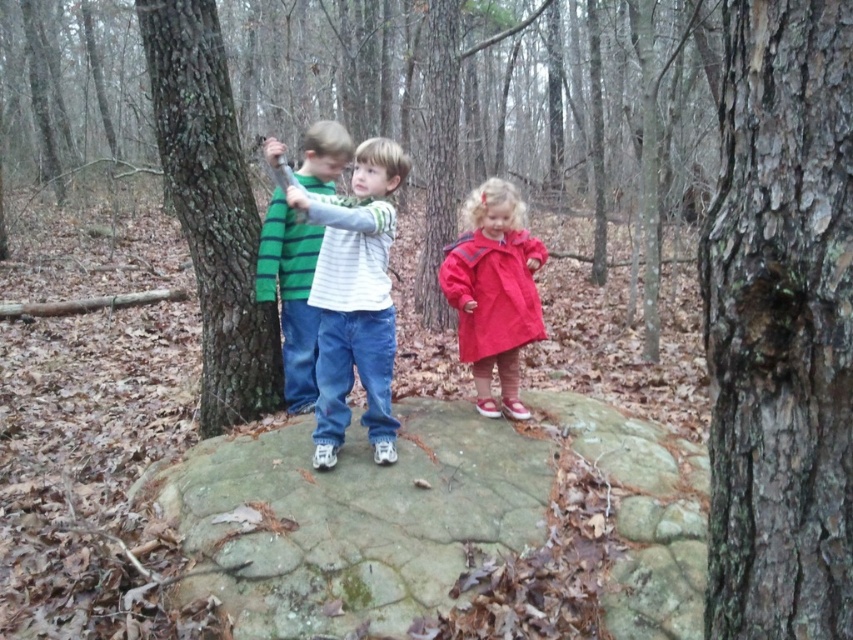
Question: Which of the following is the closest to the observer?

Choices:
 (A) (303, 179)
 (B) (393, 156)
 (C) (292, 264)

Answer: (B)

Question: Does white striped shirt at center lie behind matte red coat at center?

Choices:
 (A) no
 (B) yes

Answer: (A)

Question: Is the position of smooth brown bark at center less distant than that of green striped shirt at center?

Choices:
 (A) no
 (B) yes

Answer: (B)

Question: Which point is farther to the camera?

Choices:
 (A) green striped shirt at center
 (B) green mossy rock at center
 (C) matte red coat at center
 (D) striped cotton shirt at center

Answer: (C)

Question: Among these objects, which one is farthest from the camera?

Choices:
 (A) matte red coat at center
 (B) striped cotton shirt at center

Answer: (A)

Question: Observing the image, what is the correct spatial positioning of smooth brown bark at center in reference to smooth bark tree at left?

Choices:
 (A) right
 (B) left

Answer: (A)